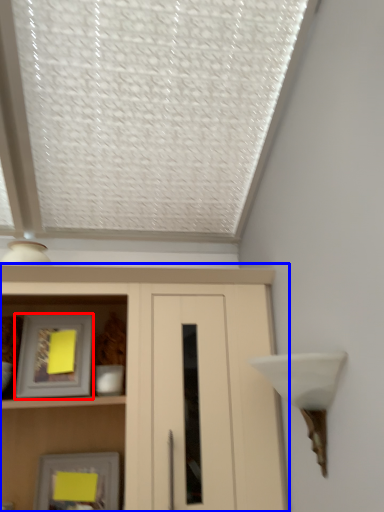
Question: Which object appears farthest to the camera in this image, picture frame (highlighted by a red box) or cupboard (highlighted by a blue box)?

Choices:
 (A) picture frame
 (B) cupboard

Answer: (A)